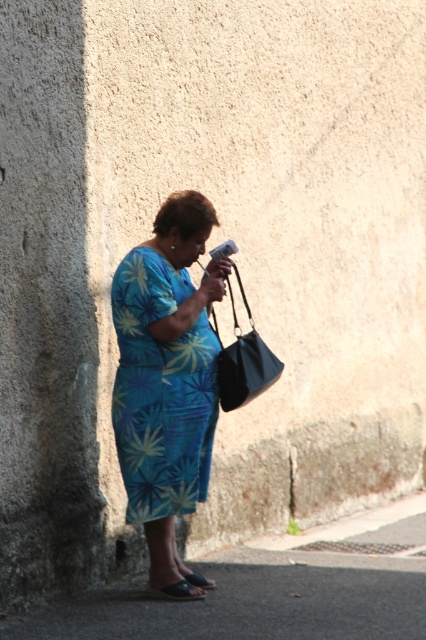
Between black leather bag at center and black fabric sandal at lower center, which one has less height?

Standing shorter between the two is black fabric sandal at lower center.

Who is taller, black leather bag at center or black fabric sandal at lower center?

black leather bag at center

Find the location of a particular element. The image size is (426, 640). black leather bag at center is located at coordinates (244, 360).

Image resolution: width=426 pixels, height=640 pixels. What do you see at coordinates (161, 390) in the screenshot?
I see `blue floral fabric dress at center` at bounding box center [161, 390].

Measure the distance between blue floral fabric dress at center and black leather bag at center.

They are 13.36 inches apart.

Measure the distance between blue floral fabric dress at center and camera.

A distance of 5.99 meters exists between blue floral fabric dress at center and camera.

Where is `blue floral fabric dress at center`? blue floral fabric dress at center is located at coordinates (161, 390).

Who is shorter, brown leather sandal at lower center or black fabric sandal at lower center?

brown leather sandal at lower center is shorter.

Image resolution: width=426 pixels, height=640 pixels. I want to click on brown leather sandal at lower center, so pos(178,589).

Between point (164, 592) and point (201, 580), which one is positioned in front?

Point (164, 592) is more forward.

Find the location of a particular element. brown leather sandal at lower center is located at coordinates (178, 589).